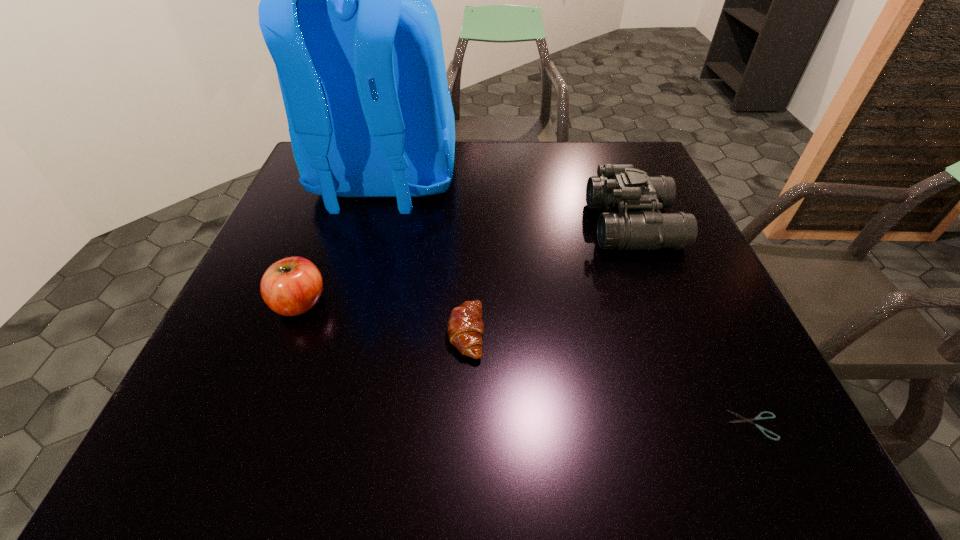
Find the location of a particular element. This screenshot has height=540, width=960. object present at the far left corner is located at coordinates (346, 14).

Locate an element on the screen. The height and width of the screenshot is (540, 960). object that is at the near right corner is located at coordinates (758, 417).

In the image, there is a desktop. At what (x,y) coordinates should I click in order to perform the action: click on vacant space at the far edge. Please return your answer as a coordinate pair (x, y). Looking at the image, I should click on (470, 161).

At what (x,y) coordinates should I click in order to perform the action: click on vacant space at the near edge of the desktop. Please return your answer as a coordinate pair (x, y). The height and width of the screenshot is (540, 960). Looking at the image, I should click on (655, 445).

The width and height of the screenshot is (960, 540). In the image, there is a desktop. Find the location of `vacant space at the left edge`. vacant space at the left edge is located at coordinates pos(239,315).

Identify the location of free space at the right edge of the desktop. (737, 390).

In the image, there is a desktop. Where is `blank space at the far right corner`? This screenshot has height=540, width=960. blank space at the far right corner is located at coordinates (647, 169).

You are a GUI agent. You are given a task and a screenshot of the screen. Output one action in this format:
    pyautogui.click(x=<x>, y=<y>)
    Task: Click on the vacant space at the near right corner
    
    Given the screenshot: What is the action you would take?
    pyautogui.click(x=721, y=442)

The image size is (960, 540). Identify the location of free spot between the third tallest object and the nearest object. (527, 364).

Image resolution: width=960 pixels, height=540 pixels. Find the location of `vacant area that lies between the binoculars and the backpack`. vacant area that lies between the binoculars and the backpack is located at coordinates (509, 205).